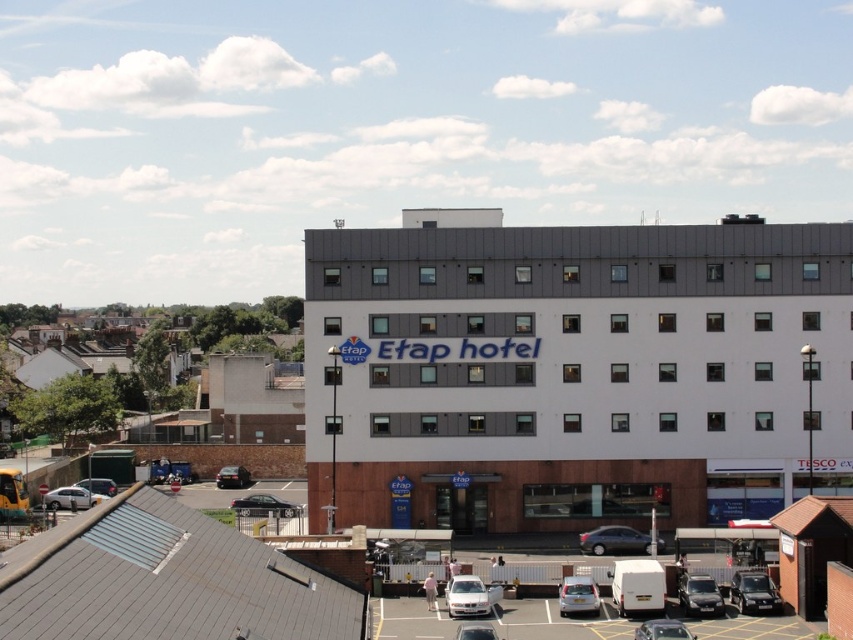
You are a guest arriving at the Etap Hotel and need to park your car. You see a shiny silver car at center and a shiny black car at lower left. Which car is positioned closer to the hotel entrance?

The shiny black car at lower left is positioned closer to the hotel entrance because it is located to the left of the shiny silver car at center, which is further to the right.

You are a delivery driver who needs to park your vehicle in the parking lot in front of the Etap Hotel. You have a silver metallic van at center and a shiny black car at lower left. Which vehicle should you choose to park in a space that requires vehicles to be no taller than the average height of the vehicles in the parking lot?

The silver metallic van at center is taller than the shiny black car at lower left. Therefore, you should choose the shiny black car at lower left to park in the space since it is shorter and meets the height requirement.

You are a delivery person needing to park your vehicle in the parking lot of the Etap Hotel. You have a silver metallic van at center and a shiny black car at lower left. Which vehicle requires a wider parking space?

The silver metallic van at center requires a wider parking space because its width surpasses that of the shiny black car at lower left.